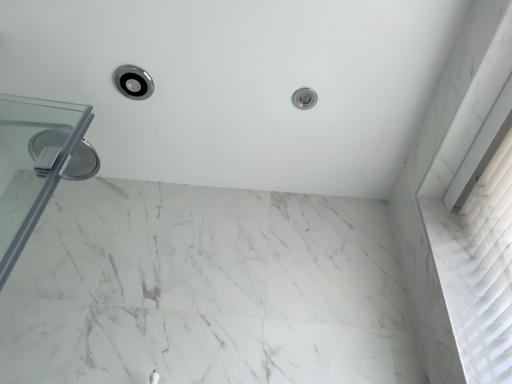
What do you see at coordinates (32, 164) in the screenshot? I see `transparent glass door at left` at bounding box center [32, 164].

The height and width of the screenshot is (384, 512). Describe the element at coordinates (239, 85) in the screenshot. I see `white marble bath at upper center` at that location.

What is the approximate width of white marble bath at upper center?

1.67 meters.

What is the approximate width of polished chrome showerhead at upper left, the second shower when ordered from right to left?

polished chrome showerhead at upper left, the second shower when ordered from right to left, is 6.01 inches wide.

Where is `transparent glass door at left`? The height and width of the screenshot is (384, 512). transparent glass door at left is located at coordinates (32, 164).

Is white marble bath at upper center aimed at transparent glass door at left?

No.

Is white marble bath at upper center taller than transparent glass door at left?

No.

Considering the sizes of objects white marble bath at upper center and transparent glass door at left in the image provided, who is wider, white marble bath at upper center or transparent glass door at left?

With larger width is white marble bath at upper center.

Is white marble bath at upper center in contact with transparent glass door at left?

No, white marble bath at upper center is not making contact with transparent glass door at left.

Considering the points (296, 92) and (11, 184), which point is in front, point (296, 92) or point (11, 184)?

Positioned in front is point (11, 184).

From the image's perspective, is satin nickel showerhead at upper center, which appears as the 2th shower when viewed from the left, positioned above or below transparent glass door at left?

satin nickel showerhead at upper center, which appears as the 2th shower when viewed from the left, is above transparent glass door at left.

Is satin nickel showerhead at upper center, the 1th shower positioned from the right, facing away from transparent glass door at left?

That's not correct — satin nickel showerhead at upper center, the 1th shower positioned from the right, is not looking away from transparent glass door at left.

Can you tell me how much satin nickel showerhead at upper center, which appears as the 2th shower when viewed from the left, and transparent glass door at left differ in facing direction?

The angle between the facing direction of satin nickel showerhead at upper center, which appears as the 2th shower when viewed from the left, and the facing direction of transparent glass door at left is 91.2 degrees.

Does polished chrome showerhead at upper left, the second shower when ordered from right to left, appear on the right side of transparent glass door at left?

Correct, you'll find polished chrome showerhead at upper left, the second shower when ordered from right to left, to the right of transparent glass door at left.

Is polished chrome showerhead at upper left, the second shower when ordered from right to left, facing towards transparent glass door at left?

No, polished chrome showerhead at upper left, the second shower when ordered from right to left, is not facing towards transparent glass door at left.

Can you confirm if polished chrome showerhead at upper left, the second shower when ordered from right to left, is smaller than transparent glass door at left?

Yes.

Is polished chrome showerhead at upper left, which is the first shower from left to right, aimed at white marble bath at upper center?

No, polished chrome showerhead at upper left, which is the first shower from left to right, is not turned towards white marble bath at upper center.

Is polished chrome showerhead at upper left, the second shower when ordered from right to left, shorter than white marble bath at upper center?

Yes, polished chrome showerhead at upper left, the second shower when ordered from right to left, is shorter than white marble bath at upper center.

In the image, is polished chrome showerhead at upper left, the second shower when ordered from right to left, positioned in front of or behind white marble bath at upper center?

polished chrome showerhead at upper left, the second shower when ordered from right to left, is positioned farther from the viewer than white marble bath at upper center.

Measure the distance between polished chrome showerhead at upper left, which is the first shower from left to right, and white marble bath at upper center.

38.60 centimeters.

Is transparent glass door at left turned away from polished chrome showerhead at upper left, which is the first shower from left to right?

No.

Looking at this image, is transparent glass door at left at the left side of polished chrome showerhead at upper left, which is the first shower from left to right?

Indeed, transparent glass door at left is positioned on the left side of polished chrome showerhead at upper left, which is the first shower from left to right.

Is transparent glass door at left placed right next to polished chrome showerhead at upper left, the second shower when ordered from right to left?

Answer: There is a gap between transparent glass door at left and polished chrome showerhead at upper left, the second shower when ordered from right to left.

Between transparent glass door at left and polished chrome showerhead at upper left, which is the first shower from left to right, which one has larger width?

With larger width is transparent glass door at left.

From a real-world perspective, is transparent glass door at left positioned above or below white marble bath at upper center?

In terms of real-world spatial position, transparent glass door at left is below white marble bath at upper center.

Is transparent glass door at left positioned with its back to white marble bath at upper center?

That's not correct — transparent glass door at left is not looking away from white marble bath at upper center.

Is there a large distance between transparent glass door at left and white marble bath at upper center?

transparent glass door at left is near white marble bath at upper center, not far away.

Does white marble bath at upper center have a greater height compared to satin nickel showerhead at upper center, which appears as the 2th shower when viewed from the left?

Yes, white marble bath at upper center is taller than satin nickel showerhead at upper center, which appears as the 2th shower when viewed from the left.

Is point (50, 49) farther from viewer compared to point (297, 92)?

No, (50, 49) is in front of (297, 92).

Does white marble bath at upper center lie in front of satin nickel showerhead at upper center, which appears as the 2th shower when viewed from the left?

Yes, white marble bath at upper center is closer to the camera.

How many degrees apart are the facing directions of white marble bath at upper center and satin nickel showerhead at upper center, which appears as the 2th shower when viewed from the left?

The angle between the facing direction of white marble bath at upper center and the facing direction of satin nickel showerhead at upper center, which appears as the 2th shower when viewed from the left, is 88.8 degrees.

Identify the location of bath that appears on the right of transparent glass door at left. (239, 85).

The height and width of the screenshot is (384, 512). Find the location of `glass door below the satin nickel showerhead at upper center, which appears as the 2th shower when viewed from the left (from a real-world perspective)`. glass door below the satin nickel showerhead at upper center, which appears as the 2th shower when viewed from the left (from a real-world perspective) is located at coordinates (32, 164).

Which object lies further to the anchor point satin nickel showerhead at upper center, which appears as the 2th shower when viewed from the left, transparent glass door at left or polished chrome showerhead at upper left, the second shower when ordered from right to left?

Based on the image, transparent glass door at left appears to be further to satin nickel showerhead at upper center, which appears as the 2th shower when viewed from the left.

From the picture: Based on their spatial positions, is transparent glass door at left or white marble bath at upper center further from satin nickel showerhead at upper center, which appears as the 2th shower when viewed from the left?

transparent glass door at left is further to satin nickel showerhead at upper center, which appears as the 2th shower when viewed from the left.

From the image, which object appears to be nearer to polished chrome showerhead at upper left, which is the first shower from left to right, satin nickel showerhead at upper center, the 1th shower positioned from the right, or transparent glass door at left?

Among the two, transparent glass door at left is located nearer to polished chrome showerhead at upper left, which is the first shower from left to right.

From the image, which object appears to be farther from transparent glass door at left, white marble bath at upper center or satin nickel showerhead at upper center, the 1th shower positioned from the right?

The object further to transparent glass door at left is satin nickel showerhead at upper center, the 1th shower positioned from the right.

From the image, which object appears to be nearer to polished chrome showerhead at upper left, the second shower when ordered from right to left, white marble bath at upper center or transparent glass door at left?

Based on the image, white marble bath at upper center appears to be nearer to polished chrome showerhead at upper left, the second shower when ordered from right to left.

From the image, which object appears to be nearer to satin nickel showerhead at upper center, the 1th shower positioned from the right, white marble bath at upper center or polished chrome showerhead at upper left, the second shower when ordered from right to left?

white marble bath at upper center lies closer to satin nickel showerhead at upper center, the 1th shower positioned from the right, than the other object.

Based on their spatial positions, is polished chrome showerhead at upper left, which is the first shower from left to right, or satin nickel showerhead at upper center, the 1th shower positioned from the right, closer to white marble bath at upper center?

Among the two, polished chrome showerhead at upper left, which is the first shower from left to right, is located nearer to white marble bath at upper center.

Based on their spatial positions, is polished chrome showerhead at upper left, which is the first shower from left to right, or white marble bath at upper center further from transparent glass door at left?

Among the two, white marble bath at upper center is located further to transparent glass door at left.

Locate an element on the screen. bath located between transparent glass door at left and satin nickel showerhead at upper center, the 1th shower positioned from the right, in the left-right direction is located at coordinates (239, 85).

At what (x,y) coordinates should I click in order to perform the action: click on bath between polished chrome showerhead at upper left, which is the first shower from left to right, and satin nickel showerhead at upper center, the 1th shower positioned from the right. Please return your answer as a coordinate pair (x, y). The image size is (512, 384). Looking at the image, I should click on (239, 85).

What are the coordinates of `bath between polished chrome showerhead at upper left, which is the first shower from left to right, and transparent glass door at left vertically` in the screenshot? It's located at (239, 85).

Find the location of a particular element. shower between transparent glass door at left and satin nickel showerhead at upper center, which appears as the 2th shower when viewed from the left is located at coordinates (133, 82).